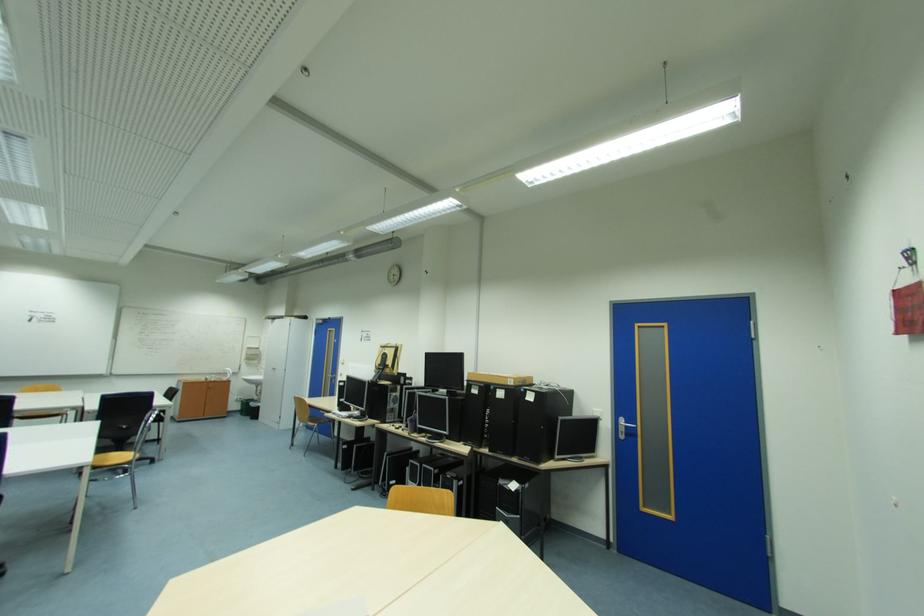
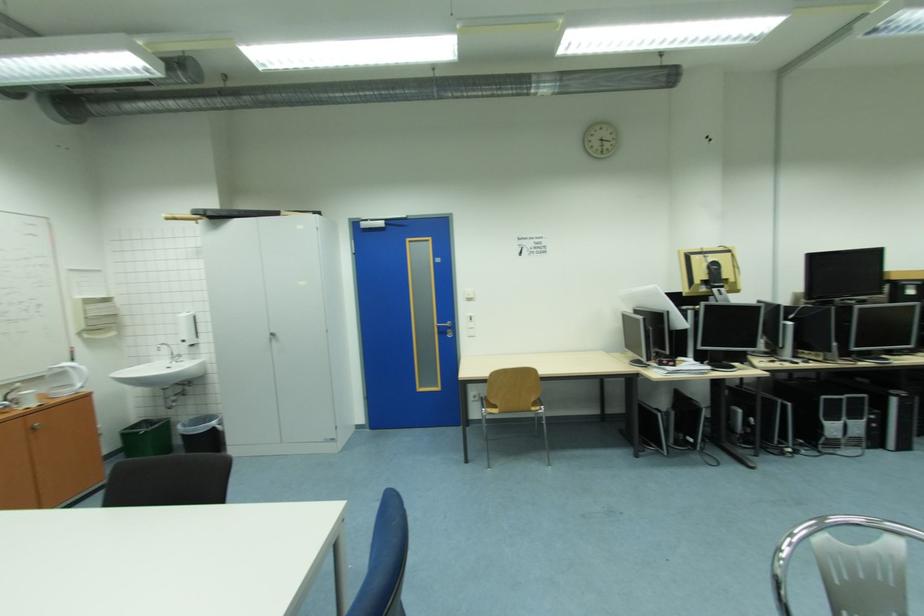
Find the pixel in the second image that matches point 256,349 in the first image.

(94, 302)